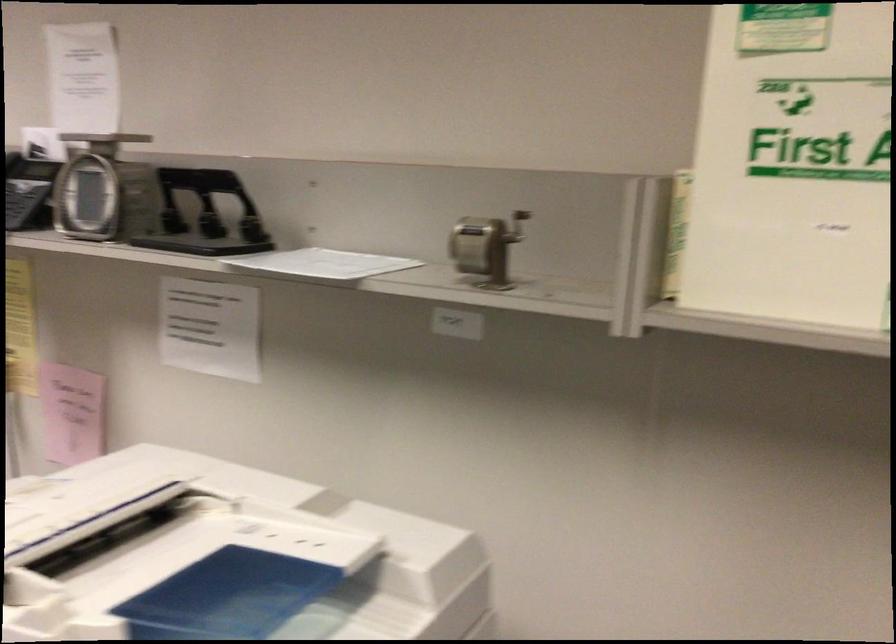
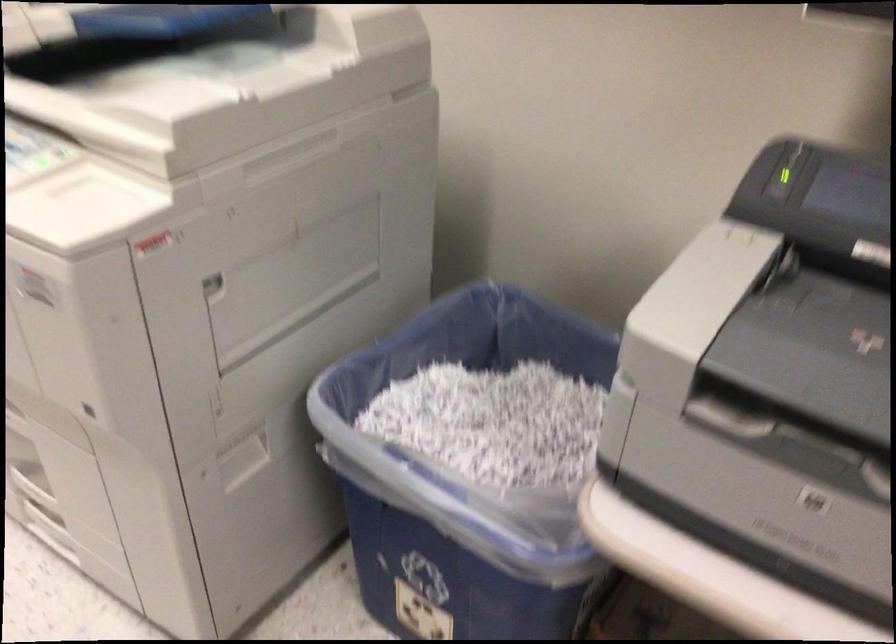
The images are taken continuously from a first-person perspective. In which direction is your viewpoint rotating?

The camera's rotation is toward right-down.